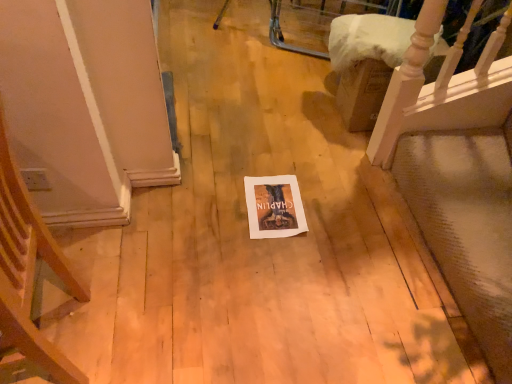
This screenshot has height=384, width=512. In order to click on free region under white paper at center (from a real-world perspective) in this screenshot , I will do pos(276,204).